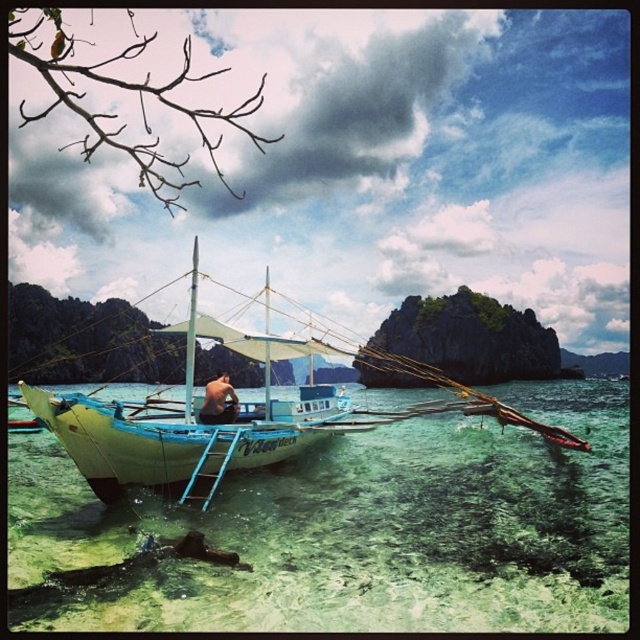
Does light blue wooden boat at center have a larger size compared to skinny man at center?

Indeed, light blue wooden boat at center has a larger size compared to skinny man at center.

This screenshot has width=640, height=640. What do you see at coordinates (232, 426) in the screenshot? I see `light blue wooden boat at center` at bounding box center [232, 426].

Find the location of `light blue wooden boat at center`. light blue wooden boat at center is located at coordinates (232, 426).

Is point (618, 518) less distant than point (170, 410)?

Yes, point (618, 518) is closer to viewer.

Who is lower down, clear glassy water at center or light blue wooden boat at center?

clear glassy water at center

In order to click on clear glassy water at center in this screenshot , I will do `click(362, 531)`.

Can you confirm if clear glassy water at center is positioned to the left of skinny man at center?

Incorrect, clear glassy water at center is not on the left side of skinny man at center.

Does clear glassy water at center have a greater width compared to skinny man at center?

Correct, the width of clear glassy water at center exceeds that of skinny man at center.

The height and width of the screenshot is (640, 640). Describe the element at coordinates (362, 531) in the screenshot. I see `clear glassy water at center` at that location.

Find the location of a particular element. The image size is (640, 640). clear glassy water at center is located at coordinates pos(362,531).